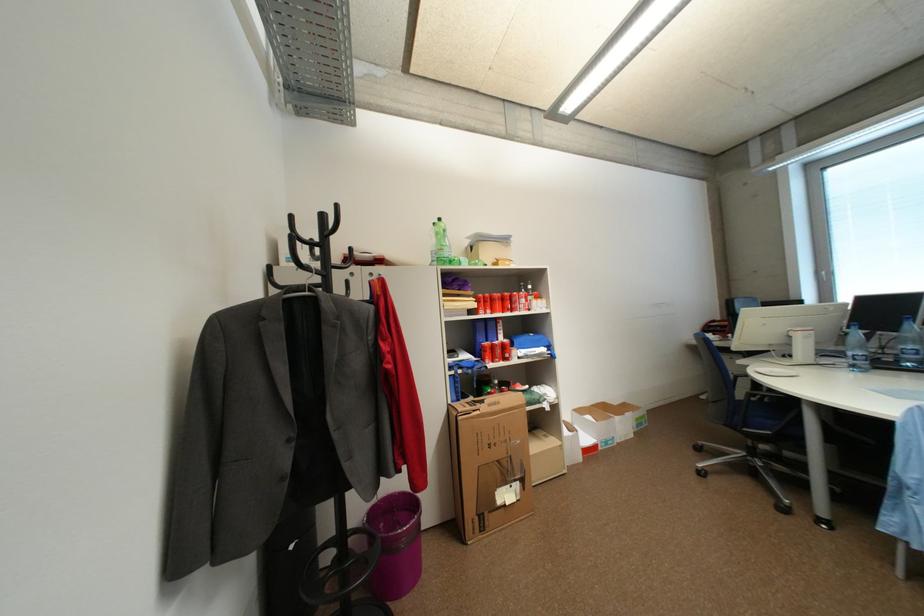
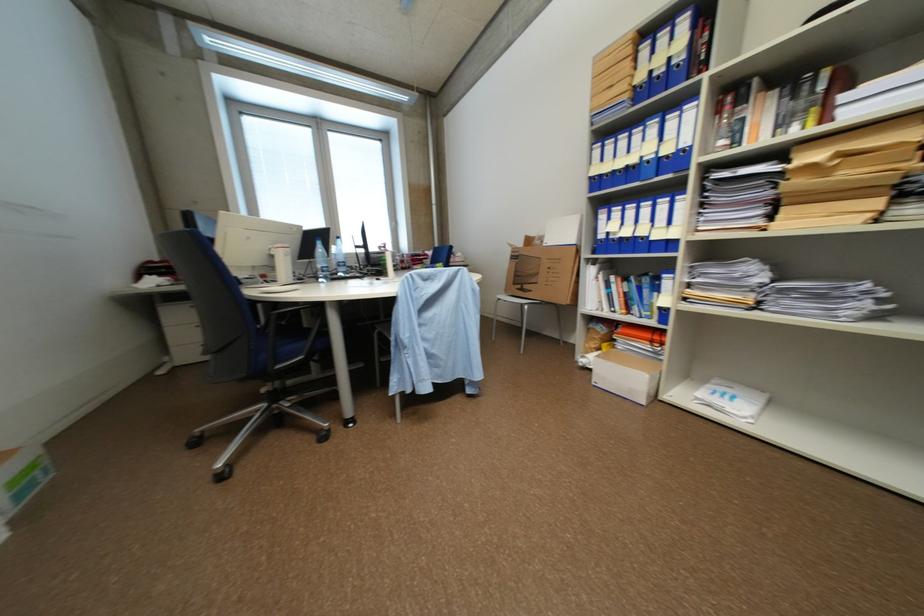
The point at (646, 427) is marked in the first image. Where is the corresponding point in the second image?

(28, 496)